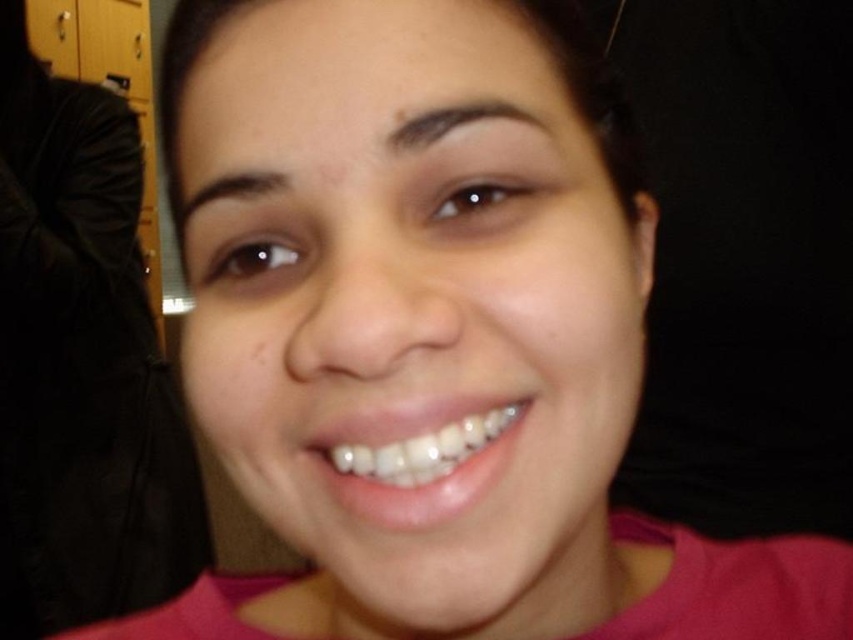
Between pink matte shirt at center and white glossy teeth at center, which one appears on the right side from the viewer's perspective?

From the viewer's perspective, white glossy teeth at center appears more on the right side.

Does pink matte shirt at center have a lesser height compared to white glossy teeth at center?

In fact, pink matte shirt at center may be taller than white glossy teeth at center.

Which is behind, point (103, 241) or point (430, 483)?

Point (103, 241)

Find the location of a particular element. Image resolution: width=853 pixels, height=640 pixels. pink matte shirt at center is located at coordinates (80, 365).